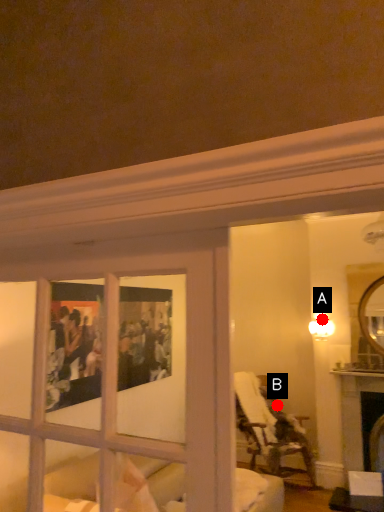
Question: Two points are circled on the image, labeled by A and B beside each circle. Which point is farther from the camera taking this photo?

Choices:
 (A) A is further
 (B) B is further

Answer: (B)